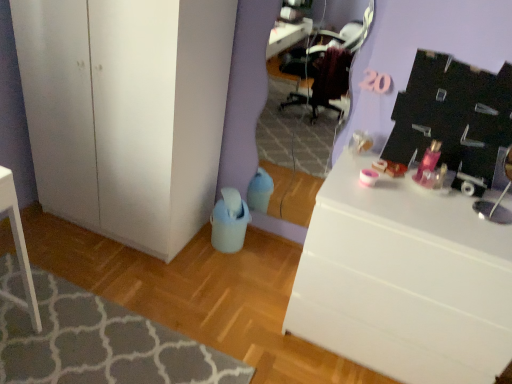
What do you see at coordinates (102, 344) in the screenshot?
I see `textured gray rug at lower left` at bounding box center [102, 344].

Image resolution: width=512 pixels, height=384 pixels. What are the coordinates of `matte purple mirror at center` in the screenshot? It's located at (292, 185).

Which of these two, white matte cabinet at lower left or textured gray rug at lower left, is bigger?

white matte cabinet at lower left.

Which is less distant, (114, 105) or (126, 315)?

The point (114, 105) is closer.

Are white matte cabinet at lower left and textured gray rug at lower left making contact?

No, white matte cabinet at lower left is not with textured gray rug at lower left.

Can you confirm if white matte cabinet at lower left is positioned to the right of textured gray rug at lower left?

Indeed, white matte cabinet at lower left is positioned on the right side of textured gray rug at lower left.

In the scene shown: Which of these two, matte purple mirror at center or white glossy desk at right, is smaller?

matte purple mirror at center.

Is matte purple mirror at center facing towards white glossy desk at right?

No, matte purple mirror at center is not turned towards white glossy desk at right.

Does matte purple mirror at center have a greater width compared to white glossy desk at right?

No.

Is matte purple mirror at center closer to camera compared to white glossy desk at right?

No.

Does white glossy desk at right contain matte purple mirror at center?

No, matte purple mirror at center is located outside of white glossy desk at right.

Is white glossy desk at right smaller than matte purple mirror at center?

Incorrect, white glossy desk at right is not smaller in size than matte purple mirror at center.

Does white glossy desk at right lie behind matte purple mirror at center?

No.

Which of these two, matte purple mirror at center or textured gray rug at lower left, stands shorter?

textured gray rug at lower left.

How many degrees apart are the facing directions of matte purple mirror at center and textured gray rug at lower left?

The angular difference between matte purple mirror at center and textured gray rug at lower left is 91.3 degrees.

Is point (294, 207) positioned after point (232, 382)?

Yes, it is.

Is matte purple mirror at center at the left side of textured gray rug at lower left?

In fact, matte purple mirror at center is to the right of textured gray rug at lower left.

Based on their positions, is white glossy desk at right located to the left or right of textured gray rug at lower left?

white glossy desk at right is positioned on textured gray rug at lower left's right side.

How far apart are white glossy desk at right and textured gray rug at lower left?

The distance of white glossy desk at right from textured gray rug at lower left is 29.63 inches.

Is white glossy desk at right aimed at textured gray rug at lower left?

No, white glossy desk at right is not turned towards textured gray rug at lower left.

Are white glossy desk at right and textured gray rug at lower left far apart?

That's not correct — white glossy desk at right is a little close to textured gray rug at lower left.

From a real-world perspective, which is physically below, white matte cabinet at lower left or white glossy desk at right?

In real-world perspective, white glossy desk at right is lower.

Which is more to the left, white matte cabinet at lower left or white glossy desk at right?

white matte cabinet at lower left.

Based on the photo, measure the distance between white matte cabinet at lower left and white glossy desk at right.

white matte cabinet at lower left is 1.01 meters from white glossy desk at right.

Is the position of white matte cabinet at lower left more distant than that of white glossy desk at right?

Yes, white matte cabinet at lower left is behind white glossy desk at right.

From a real-world perspective, between white glossy desk at right and white matte cabinet at lower left, who is vertically higher?

From a 3D spatial view, white matte cabinet at lower left is above.

Relative to white matte cabinet at lower left, is white glossy desk at right in front or behind?

Clearly, white glossy desk at right is in front of white matte cabinet at lower left.

What's the angular difference between white glossy desk at right and white matte cabinet at lower left's facing directions?

There is a 0.734-degree angle between the facing directions of white glossy desk at right and white matte cabinet at lower left.

From the image's perspective, would you say white glossy desk at right is shown under white matte cabinet at lower left?

Yes, from the image's perspective, white glossy desk at right is below white matte cabinet at lower left.

The height and width of the screenshot is (384, 512). Identify the location of cabinetry above the textured gray rug at lower left (from a real-world perspective). (126, 112).

Where is `mirror that is above the white glossy desk at right (from the image's perspective)`? The image size is (512, 384). mirror that is above the white glossy desk at right (from the image's perspective) is located at coordinates (292, 185).

Considering their positions, is white glossy desk at right positioned closer to matte purple mirror at center than textured gray rug at lower left?

white glossy desk at right.

Which object lies further to the anchor point textured gray rug at lower left, white glossy desk at right or matte purple mirror at center?

The object further to textured gray rug at lower left is matte purple mirror at center.

Looking at the image, which one is located further to white matte cabinet at lower left, matte purple mirror at center or white glossy desk at right?

matte purple mirror at center is positioned further to the anchor white matte cabinet at lower left.

From the image, which object appears to be nearer to textured gray rug at lower left, white matte cabinet at lower left or matte purple mirror at center?

Based on the image, white matte cabinet at lower left appears to be nearer to textured gray rug at lower left.

Consider the image. Based on their spatial positions, is textured gray rug at lower left or matte purple mirror at center further from white matte cabinet at lower left?

matte purple mirror at center lies further to white matte cabinet at lower left than the other object.

From the image, which object appears to be farther from white glossy desk at right, white matte cabinet at lower left or matte purple mirror at center?

matte purple mirror at center lies further to white glossy desk at right than the other object.

Considering their positions, is textured gray rug at lower left positioned closer to white glossy desk at right than white matte cabinet at lower left?

The object closer to white glossy desk at right is textured gray rug at lower left.

Considering their positions, is matte purple mirror at center positioned closer to white matte cabinet at lower left than textured gray rug at lower left?

Among the two, textured gray rug at lower left is located nearer to white matte cabinet at lower left.

This screenshot has height=384, width=512. I want to click on mirror between white matte cabinet at lower left and white glossy desk at right from left to right, so click(292, 185).

Locate an element on the screen. The height and width of the screenshot is (384, 512). mirror between textured gray rug at lower left and white glossy desk at right from left to right is located at coordinates tap(292, 185).

Find the location of a particular element. The height and width of the screenshot is (384, 512). mirror between white matte cabinet at lower left and textured gray rug at lower left from top to bottom is located at coordinates (292, 185).

The height and width of the screenshot is (384, 512). What are the coordinates of `cabinetry located between textured gray rug at lower left and white glossy desk at right in the left-right direction` in the screenshot? It's located at (126, 112).